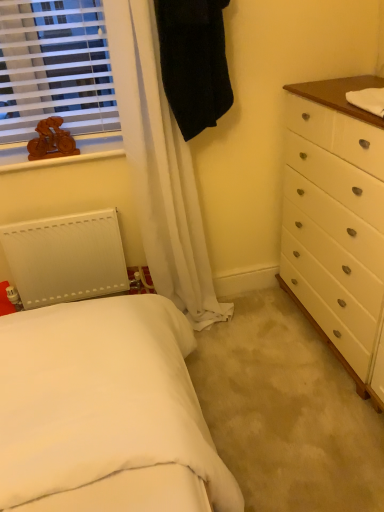
This screenshot has width=384, height=512. What do you see at coordinates (194, 62) in the screenshot?
I see `black fabric robe at upper center` at bounding box center [194, 62].

I want to click on black fabric robe at upper center, so click(194, 62).

The height and width of the screenshot is (512, 384). What do you see at coordinates (54, 68) in the screenshot?
I see `wooden bicycle at upper left` at bounding box center [54, 68].

This screenshot has height=512, width=384. What do you see at coordinates (51, 141) in the screenshot? I see `wooden bicycle at upper left` at bounding box center [51, 141].

Where is `brown wooden counter top at upper right`? The image size is (384, 512). brown wooden counter top at upper right is located at coordinates (340, 95).

Measure the distance between brown wooden counter top at upper right and wooden bicycle at upper left.

The distance of brown wooden counter top at upper right from wooden bicycle at upper left is 37.42 inches.

Is brown wooden counter top at upper right not inside wooden bicycle at upper left?

Absolutely, brown wooden counter top at upper right is external to wooden bicycle at upper left.

Between brown wooden counter top at upper right and wooden bicycle at upper left, which one has smaller width?

Thinner between the two is wooden bicycle at upper left.

Between brown wooden counter top at upper right and wooden bicycle at upper left, which one has smaller size?

Smaller between the two is brown wooden counter top at upper right.

Is brown wooden counter top at upper right not within white matte radiator at lower left?

brown wooden counter top at upper right lies outside white matte radiator at lower left's area.

This screenshot has height=512, width=384. I want to click on radiator that appears on the left of brown wooden counter top at upper right, so click(66, 258).

From a real-world perspective, is brown wooden counter top at upper right over white matte radiator at lower left?

Correct, in the physical world, brown wooden counter top at upper right is higher than white matte radiator at lower left.

From the image's perspective, is brown wooden counter top at upper right located above or below white matte radiator at lower left?

Based on their image positions, brown wooden counter top at upper right is located above white matte radiator at lower left.

Between white matte radiator at lower left and brown wooden counter top at upper right, which one has smaller size?

brown wooden counter top at upper right.

In terms of width, does white matte radiator at lower left look wider or thinner when compared to brown wooden counter top at upper right?

In the image, white matte radiator at lower left appears to be more narrow than brown wooden counter top at upper right.

Between point (100, 249) and point (370, 115), which one is positioned in front?

The point (370, 115) is more forward.

From a real-world perspective, who is located higher, wooden bicycle at upper left or brown wooden counter top at upper right?

wooden bicycle at upper left is physically above.

Does wooden bicycle at upper left turn towards brown wooden counter top at upper right?

No.

Does wooden bicycle at upper left have a greater width compared to brown wooden counter top at upper right?

In fact, wooden bicycle at upper left might be narrower than brown wooden counter top at upper right.

From the image's perspective, which one is positioned lower, wooden bicycle at upper left or brown wooden counter top at upper right?

brown wooden counter top at upper right is shown below in the image.

Looking at this image, could you tell me if white matte radiator at lower left is facing black fabric robe at upper center?

No, white matte radiator at lower left does not turn towards black fabric robe at upper center.

From a real-world perspective, does white matte radiator at lower left sit lower than black fabric robe at upper center?

Yes, from a real-world perspective, white matte radiator at lower left is beneath black fabric robe at upper center.

Which is closer, (26, 243) or (222, 9)?

Point (26, 243) is positioned farther from the camera compared to point (222, 9).

Considering the sizes of objects white matte radiator at lower left and black fabric robe at upper center in the image provided, who is smaller, white matte radiator at lower left or black fabric robe at upper center?

Smaller between the two is white matte radiator at lower left.

Is black fabric robe at upper center facing towards wooden bicycle at upper left?

No, black fabric robe at upper center does not turn towards wooden bicycle at upper left.

Locate an element on the screen. robe lying on the right of wooden bicycle at upper left is located at coordinates [x=194, y=62].

From a real-world perspective, is black fabric robe at upper center over wooden bicycle at upper left?

No, from a real-world perspective, black fabric robe at upper center is not over wooden bicycle at upper left

From the image's perspective, who appears lower, black fabric robe at upper center or wooden bicycle at upper left?

black fabric robe at upper center appears lower in the image.

Which of these two, wooden bicycle at upper left or wooden bicycle at upper left, is smaller?

wooden bicycle at upper left.

Is wooden bicycle at upper left oriented away from wooden bicycle at upper left?

Absolutely, wooden bicycle at upper left is directed away from wooden bicycle at upper left.

Between wooden bicycle at upper left and wooden bicycle at upper left, which one has less height?

wooden bicycle at upper left.

From a real-world perspective, is wooden bicycle at upper left on wooden bicycle at upper left?

No, from a real-world perspective, wooden bicycle at upper left is not above wooden bicycle at upper left.

In order to click on window on the left of brown wooden counter top at upper right in this screenshot , I will do `click(54, 68)`.

Image resolution: width=384 pixels, height=512 pixels. Identify the location of radiator that is under the brown wooden counter top at upper right (from a real-world perspective). (66, 258).

From the image, which object appears to be nearer to wooden bicycle at upper left, brown wooden counter top at upper right or wooden bicycle at upper left?

wooden bicycle at upper left is closer to wooden bicycle at upper left.

Looking at the image, which one is located closer to black fabric robe at upper center, wooden bicycle at upper left or white matte radiator at lower left?

Among the two, wooden bicycle at upper left is located nearer to black fabric robe at upper center.

Considering their positions, is wooden bicycle at upper left positioned closer to brown wooden counter top at upper right than wooden bicycle at upper left?

wooden bicycle at upper left lies closer to brown wooden counter top at upper right than the other object.

Based on their spatial positions, is brown wooden counter top at upper right or wooden bicycle at upper left further from white matte radiator at lower left?

Based on the image, brown wooden counter top at upper right appears to be further to white matte radiator at lower left.

From the image, which object appears to be nearer to black fabric robe at upper center, wooden bicycle at upper left or wooden bicycle at upper left?

wooden bicycle at upper left is positioned closer to the anchor black fabric robe at upper center.

In the scene shown: Looking at the image, which one is located further to wooden bicycle at upper left, wooden bicycle at upper left or white matte radiator at lower left?

white matte radiator at lower left is positioned further to the anchor wooden bicycle at upper left.

When comparing their distances from black fabric robe at upper center, does white matte radiator at lower left or wooden bicycle at upper left seem further?

Among the two, white matte radiator at lower left is located further to black fabric robe at upper center.

Based on their spatial positions, is wooden bicycle at upper left or brown wooden counter top at upper right closer to wooden bicycle at upper left?

wooden bicycle at upper left.

Where is `window located between white matte radiator at lower left and brown wooden counter top at upper right in the left-right direction`? The width and height of the screenshot is (384, 512). window located between white matte radiator at lower left and brown wooden counter top at upper right in the left-right direction is located at coordinates (54, 68).

Find the location of `robe between white matte radiator at lower left and brown wooden counter top at upper right from left to right`. robe between white matte radiator at lower left and brown wooden counter top at upper right from left to right is located at coordinates (194, 62).

Where is `robe that lies between wooden bicycle at upper left and white matte radiator at lower left from top to bottom`? The height and width of the screenshot is (512, 384). robe that lies between wooden bicycle at upper left and white matte radiator at lower left from top to bottom is located at coordinates (194, 62).

Identify the location of window between wooden bicycle at upper left and brown wooden counter top at upper right from left to right. (54, 68).